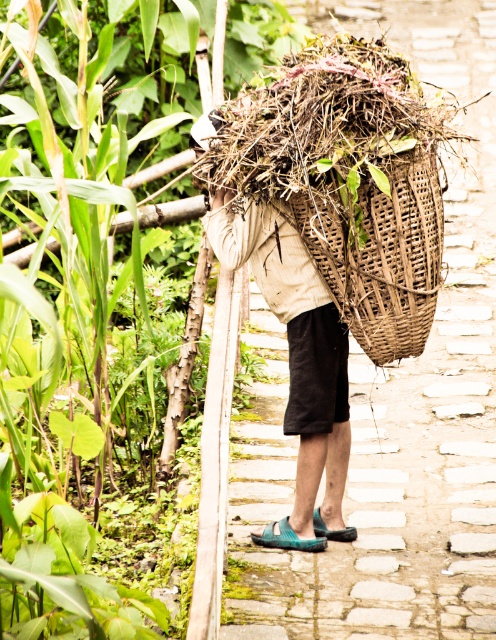
Question: Which point is farther to the camera?

Choices:
 (A) (324, 246)
 (B) (430, 552)

Answer: (B)

Question: Which point is closer to the camera?

Choices:
 (A) brown woven basket at center
 (B) woven brown basket at upper center

Answer: (B)

Question: Which point appears farthest from the camera in this image?

Choices:
 (A) (345, 296)
 (B) (324, 563)

Answer: (B)

Question: Is brown woven basket at center smaller than woven brown basket at upper center?

Choices:
 (A) no
 (B) yes

Answer: (A)

Question: Does brown woven basket at center appear under woven brown basket at upper center?

Choices:
 (A) yes
 (B) no

Answer: (B)

Question: Is brown woven basket at center to the left of woven brown basket at upper center from the viewer's perspective?

Choices:
 (A) no
 (B) yes

Answer: (A)